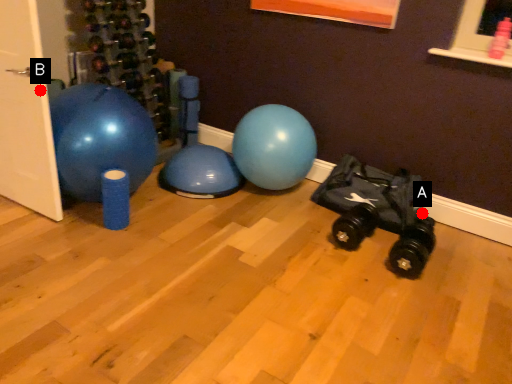
Question: Two points are circled on the image, labeled by A and B beside each circle. Which of the following is the closest to the observer?

Choices:
 (A) A is closer
 (B) B is closer

Answer: (B)